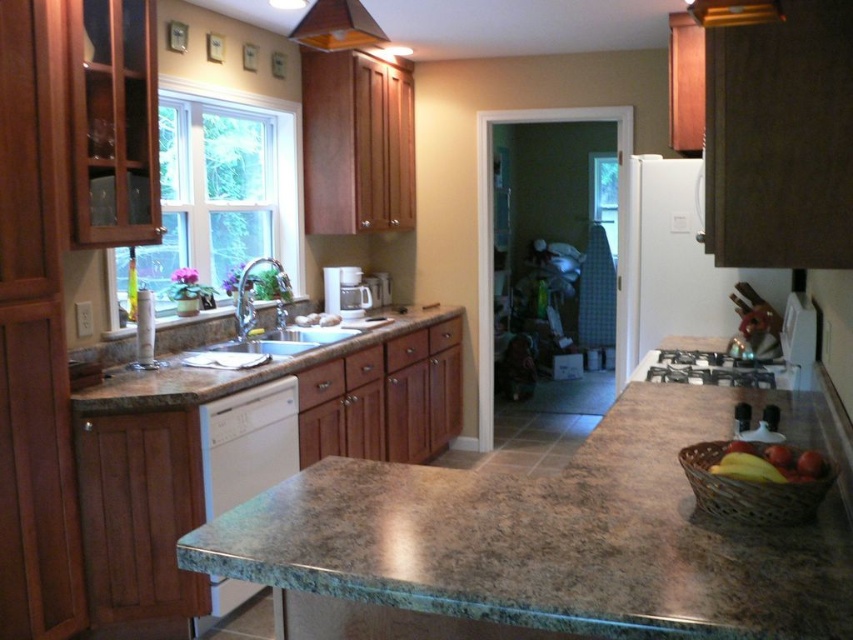
You are standing in the kitchen and want to place a new spice jar on the countertop. The brown woven basket at lower right is currently occupying the space at point (747, 490). Is there enough space to move the basket to the left to make room for the spice jar?

The brown woven basket at lower right is located at point (747, 490). Since the question does not provide information about the size of the basket or the available space to its left, it is impossible to determine if moving it would create enough room for the spice jar.

You are organizing your kitchen and want to place a new spice rack between the brown woven basket at lower right and the orange matte exhaust hood at upper center. Based on their positions, can you determine which object is closer to you so you can position the spice rack appropriately?

The brown woven basket at lower right is in front of the orange matte exhaust hood at upper center, so it is closer to you. Position the spice rack between them accordingly.